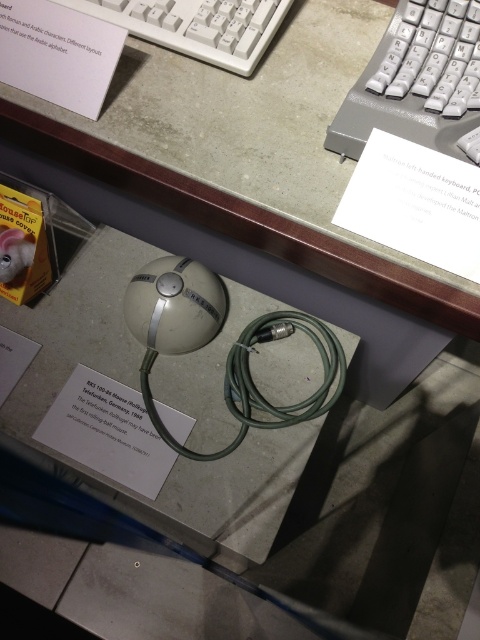
You are setting up a display for a tech museum. You have a white plastic keyboard at upper center and a white matte sphere at center. Which object should you place closer to the visitors to ensure they can see both items clearly?

The white plastic keyboard at upper center is smaller than the white matte sphere at center, so you should place the white plastic keyboard at upper center closer to the visitors to ensure both items are visible.